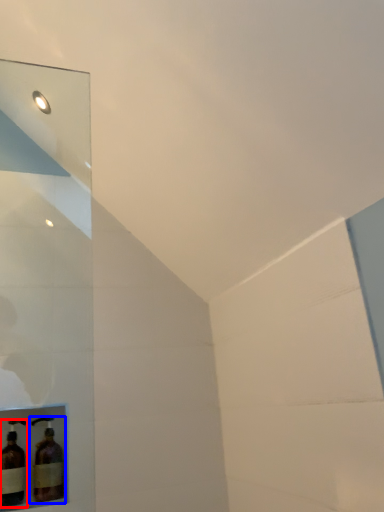
Question: Which object is further to the camera taking this photo, bottle (highlighted by a red box) or bottle (highlighted by a blue box)?

Choices:
 (A) bottle
 (B) bottle

Answer: (B)